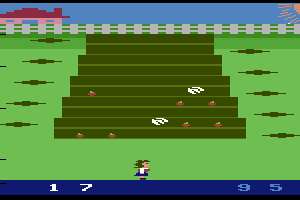
Find the location of `window`. window is located at coordinates (51, 23), (18, 15).